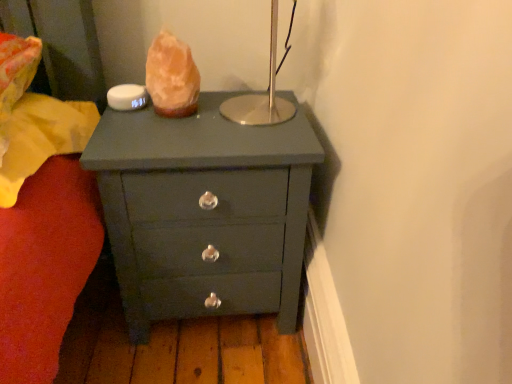
Question: Based on their sizes in the image, would you say matte dark green chest of drawers at center is bigger or smaller than orange crystal at center?

Choices:
 (A) big
 (B) small

Answer: (A)

Question: From the image's perspective, is matte dark green chest of drawers at center positioned above or below orange crystal at center?

Choices:
 (A) above
 (B) below

Answer: (B)

Question: Choose the correct answer: Is matte dark green chest of drawers at center inside orange crystal at center or outside it?

Choices:
 (A) inside
 (B) outside

Answer: (B)

Question: Considering the positions of orange crystal at center and matte dark green chest of drawers at center in the image, is orange crystal at center bigger or smaller than matte dark green chest of drawers at center?

Choices:
 (A) small
 (B) big

Answer: (A)

Question: From their relative heights in the image, would you say orange crystal at center is taller or shorter than matte dark green chest of drawers at center?

Choices:
 (A) short
 (B) tall

Answer: (A)

Question: Is orange crystal at center inside the boundaries of matte dark green chest of drawers at center, or outside?

Choices:
 (A) outside
 (B) inside

Answer: (A)

Question: Considering the relative positions of orange crystal at center and matte dark green chest of drawers at center in the image provided, is orange crystal at center to the left or to the right of matte dark green chest of drawers at center?

Choices:
 (A) right
 (B) left

Answer: (B)